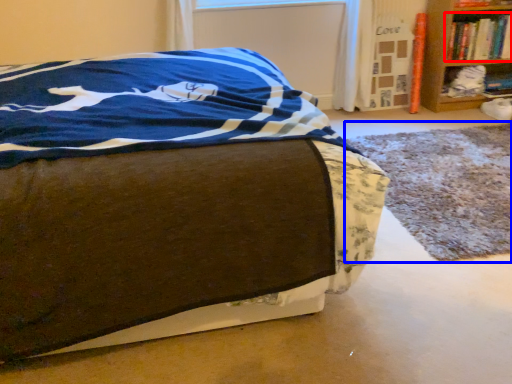
Question: Which object appears farthest to the camera in this image, book (highlighted by a red box) or cat bed (highlighted by a blue box)?

Choices:
 (A) book
 (B) cat bed

Answer: (A)